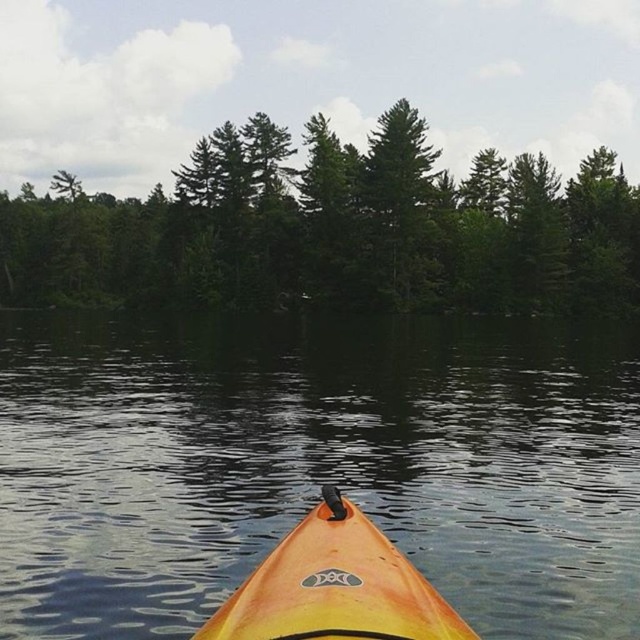
You are in a kayak and want to reach a point marked at coordinates [228,499]. The kayak is 4 meters long. Can you reach that point without getting out of the kayak?

The point at coordinates [228,499] is 11.45 meters away from the camera. Since the kayak is 4 meters long, you can reach it without getting out as the distance is greater than the kayak length.